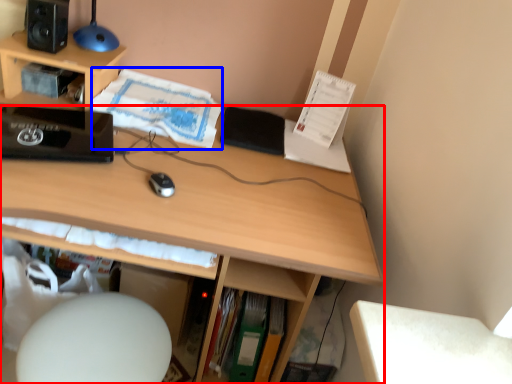
Question: Among these objects, which one is nearest to the camera, desk (highlighted by a red box) or book (highlighted by a blue box)?

Choices:
 (A) desk
 (B) book

Answer: (A)